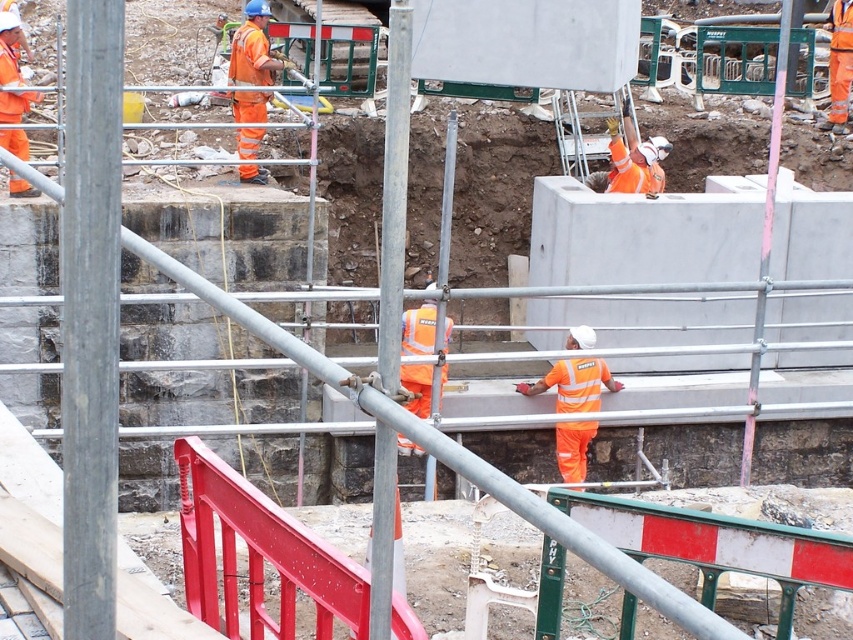
Which is above, orange reflective vest at center or orange reflective workwear at upper center?

orange reflective workwear at upper center

Is orange reflective vest at center to the right of orange reflective workwear at upper center from the viewer's perspective?

Yes, orange reflective vest at center is to the right of orange reflective workwear at upper center.

Which is in front, point (590, 404) or point (244, 180)?

Point (590, 404) is more forward.

Where is `orange reflective vest at center`? orange reflective vest at center is located at coordinates (573, 384).